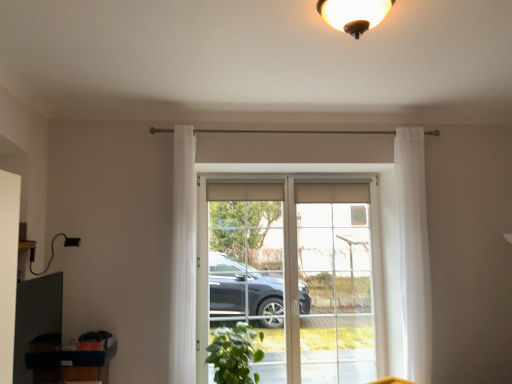
Question: Considering the relative sizes of green leafy plant at lower center and white sheer curtain at right, which is counted as the first curtain, starting from the right, in the image provided, is green leafy plant at lower center smaller than white sheer curtain at right, which is counted as the first curtain, starting from the right,?

Choices:
 (A) yes
 (B) no

Answer: (B)

Question: Are green leafy plant at lower center and white sheer curtain at right, placed as the 2th curtain when sorted from left to right, making contact?

Choices:
 (A) yes
 (B) no

Answer: (B)

Question: Is green leafy plant at lower center surrounding white sheer curtain at right, which is counted as the first curtain, starting from the right?

Choices:
 (A) no
 (B) yes

Answer: (A)

Question: Can you confirm if green leafy plant at lower center is wider than white sheer curtain at right, which is counted as the first curtain, starting from the right?

Choices:
 (A) no
 (B) yes

Answer: (B)

Question: Considering the relative positions of green leafy plant at lower center and white sheer curtain at right, placed as the 2th curtain when sorted from left to right, in the image provided, is green leafy plant at lower center to the right of white sheer curtain at right, placed as the 2th curtain when sorted from left to right, from the viewer's perspective?

Choices:
 (A) no
 (B) yes

Answer: (A)

Question: From the image's perspective, would you say green leafy plant at lower center is shown under white sheer curtain at right, which is counted as the first curtain, starting from the right?

Choices:
 (A) yes
 (B) no

Answer: (A)

Question: Is matte gold light fixture at upper center shorter than clear glass door at center?

Choices:
 (A) yes
 (B) no

Answer: (A)

Question: From the image's perspective, would you say matte gold light fixture at upper center is shown under clear glass door at center?

Choices:
 (A) no
 (B) yes

Answer: (A)

Question: Does matte gold light fixture at upper center have a smaller size compared to clear glass door at center?

Choices:
 (A) yes
 (B) no

Answer: (A)

Question: Does matte gold light fixture at upper center have a greater height compared to clear glass door at center?

Choices:
 (A) yes
 (B) no

Answer: (B)

Question: Does matte gold light fixture at upper center touch clear glass door at center?

Choices:
 (A) yes
 (B) no

Answer: (B)

Question: Considering the relative positions of matte gold light fixture at upper center and clear glass door at center in the image provided, is matte gold light fixture at upper center to the right of clear glass door at center from the viewer's perspective?

Choices:
 (A) no
 (B) yes

Answer: (A)

Question: Considering the relative sizes of clear glass window at center and clear glass door at center in the image provided, is clear glass window at center smaller than clear glass door at center?

Choices:
 (A) no
 (B) yes

Answer: (A)